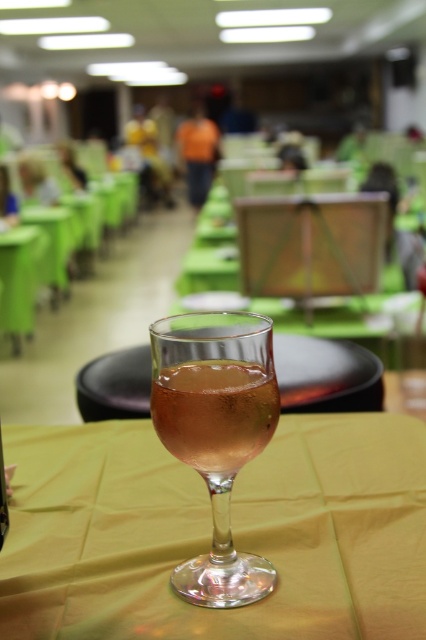
Find the location of a particular element. The image size is (426, 640). translucent glass at center is located at coordinates (215, 413).

Is point (204, 435) positioned after point (3, 257)?

No, it is not.

At what (x,y) coordinates should I click in order to perform the action: click on translucent glass at center. Please return your answer as a coordinate pair (x, y). This screenshot has width=426, height=640. Looking at the image, I should click on (215, 413).

Can you confirm if transparent glass at center is thinner than clear glass wine glass at center?

No, transparent glass at center is not thinner than clear glass wine glass at center.

Does point (396, 556) lie behind point (221, 516)?

Yes, point (396, 556) is farther from viewer.

I want to click on transparent glass at center, so click(x=210, y=532).

Between clear glass wine glass at center and green fabric table at lower left, which one is positioned higher?

green fabric table at lower left is higher up.

Does clear glass wine glass at center have a greater height compared to green fabric table at lower left?

No, clear glass wine glass at center is not taller than green fabric table at lower left.

Where is `clear glass wine glass at center`? The width and height of the screenshot is (426, 640). clear glass wine glass at center is located at coordinates (215, 433).

I want to click on clear glass wine glass at center, so click(215, 433).